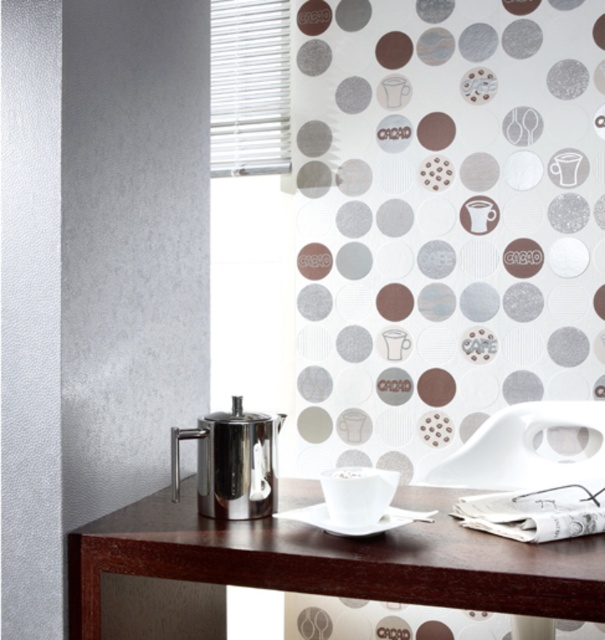
Question: Is shiny dark wood table at center closer to camera compared to polished stainless steel teapot at left?

Choices:
 (A) yes
 (B) no

Answer: (A)

Question: Does shiny dark wood table at center appear under polished stainless steel teapot at left?

Choices:
 (A) no
 (B) yes

Answer: (B)

Question: Does shiny dark wood table at center have a greater width compared to polished stainless steel teapot at left?

Choices:
 (A) no
 (B) yes

Answer: (B)